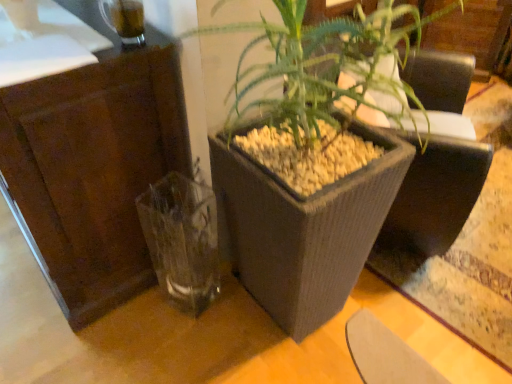
Question: Does matte gray planter at center have a smaller size compared to transparent glass vase at lower left?

Choices:
 (A) no
 (B) yes

Answer: (A)

Question: Is matte gray planter at center positioned with its back to transparent glass vase at lower left?

Choices:
 (A) yes
 (B) no

Answer: (B)

Question: Does matte gray planter at center have a greater width compared to transparent glass vase at lower left?

Choices:
 (A) no
 (B) yes

Answer: (B)

Question: Is matte gray planter at center next to transparent glass vase at lower left?

Choices:
 (A) no
 (B) yes

Answer: (A)

Question: Is matte gray planter at center at the right side of transparent glass vase at lower left?

Choices:
 (A) yes
 (B) no

Answer: (A)

Question: Relative to transparent glass vase at lower left, is brown wood dresser at left in front or behind?

Choices:
 (A) front
 (B) behind

Answer: (A)

Question: Is brown wood dresser at left inside the boundaries of transparent glass vase at lower left, or outside?

Choices:
 (A) outside
 (B) inside

Answer: (A)

Question: From a real-world perspective, is brown wood dresser at left positioned above or below transparent glass vase at lower left?

Choices:
 (A) above
 (B) below

Answer: (A)

Question: Does point (155, 77) appear closer or farther from the camera than point (162, 264)?

Choices:
 (A) farther
 (B) closer

Answer: (B)

Question: Is matte gray planter at center inside the boundaries of transparent glass vase at lower left, or outside?

Choices:
 (A) outside
 (B) inside

Answer: (A)

Question: Considering their positions, is matte gray planter at center located in front of or behind transparent glass vase at lower left?

Choices:
 (A) behind
 (B) front

Answer: (B)

Question: Is matte gray planter at center taller or shorter than transparent glass vase at lower left?

Choices:
 (A) tall
 (B) short

Answer: (A)

Question: Looking at the image, does matte gray planter at center seem bigger or smaller compared to transparent glass vase at lower left?

Choices:
 (A) small
 (B) big

Answer: (B)

Question: Relative to brown wood dresser at left, is matte gray planter at center in front or behind?

Choices:
 (A) behind
 (B) front

Answer: (B)

Question: Is matte gray planter at center situated inside brown wood dresser at left or outside?

Choices:
 (A) outside
 (B) inside

Answer: (A)